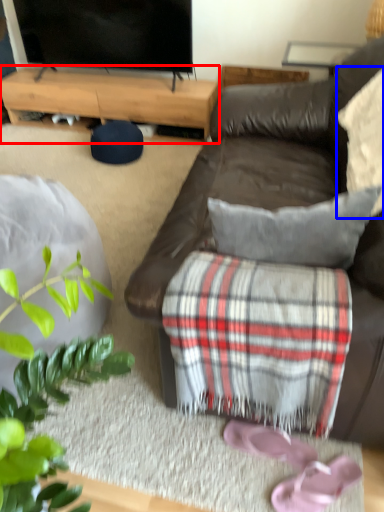
Question: Among these objects, which one is farthest to the camera, desk (highlighted by a red box) or pillow (highlighted by a blue box)?

Choices:
 (A) desk
 (B) pillow

Answer: (A)